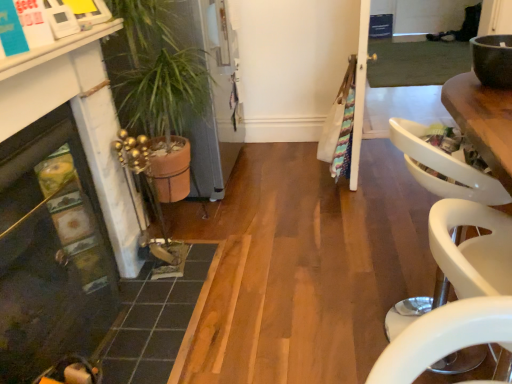
From the picture: What is the approximate width of white plastic armchair at right?

It is 38.18 centimeters.

This screenshot has height=384, width=512. What do you see at coordinates (55, 49) in the screenshot?
I see `white glossy counter top at upper left` at bounding box center [55, 49].

The width and height of the screenshot is (512, 384). What do you see at coordinates (493, 60) in the screenshot? I see `matte brown bowl at upper right` at bounding box center [493, 60].

Locate an element on the screen. Image resolution: width=512 pixels, height=384 pixels. matte brown bowl at upper right is located at coordinates (493, 60).

Locate an element on the screen. dark gray tile at lower left is located at coordinates (153, 322).

This screenshot has width=512, height=384. In order to click on white plastic armchair at right in this screenshot , I will do `click(443, 164)`.

Which is less distant, [87,311] or [65,42]?

Point [65,42]

Considering the sizes of matte black fireplace at lower left and white glossy counter top at upper left in the image, is matte black fireplace at lower left taller or shorter than white glossy counter top at upper left?

Clearly, matte black fireplace at lower left is taller compared to white glossy counter top at upper left.

Can you confirm if matte black fireplace at lower left is wider than white glossy counter top at upper left?

Incorrect, the width of matte black fireplace at lower left does not surpass that of white glossy counter top at upper left.

Could you tell me if matte black fireplace at lower left is turned towards white glossy counter top at upper left?

No, matte black fireplace at lower left is not oriented towards white glossy counter top at upper left.

Is dark gray tile at lower left in contact with matte black fireplace at lower left?

No, dark gray tile at lower left is not next to matte black fireplace at lower left.

Based on the photo, from a real-world perspective, does dark gray tile at lower left stand above matte black fireplace at lower left?

Incorrect, from a real-world perspective, dark gray tile at lower left is lower than matte black fireplace at lower left.

Which object is closer to the camera taking this photo, dark gray tile at lower left or matte black fireplace at lower left?

matte black fireplace at lower left is closer to the camera.

Does matte brown bowl at upper right come in front of white glossy counter top at upper left?

That is False.

From a real-world perspective, is matte brown bowl at upper right positioned over white glossy counter top at upper left based on gravity?

Incorrect, from a real-world perspective, matte brown bowl at upper right is lower than white glossy counter top at upper left.

Consider the image. Is matte brown bowl at upper right taller than white glossy counter top at upper left?

Correct, matte brown bowl at upper right is much taller as white glossy counter top at upper left.

Would you say matte brown bowl at upper right is a long distance from white glossy counter top at upper left?

matte brown bowl at upper right is positioned a significant distance from white glossy counter top at upper left.

Measure the distance from white plastic armchair at right to white glossy counter top at upper left.

A distance of 1.19 meters exists between white plastic armchair at right and white glossy counter top at upper left.

Is white plastic armchair at right oriented away from white glossy counter top at upper left?

white plastic armchair at right does not have its back to white glossy counter top at upper left.

Between white plastic armchair at right and white glossy counter top at upper left, which one has smaller size?

white glossy counter top at upper left.

Would you say white plastic armchair at right is inside or outside white glossy counter top at upper left?

white plastic armchair at right is outside white glossy counter top at upper left.

At what (x,y) coordinates should I click in order to perform the action: click on fireplace on the left of white glossy counter top at upper left. Please return your answer as a coordinate pair (x, y). Looking at the image, I should click on (51, 253).

Which is in front, point (20, 72) or point (25, 158)?

The point (20, 72) is closer to the camera.

Considering the relative positions of white glossy counter top at upper left and matte black fireplace at lower left in the image provided, is white glossy counter top at upper left in front of matte black fireplace at lower left?

No, white glossy counter top at upper left is behind matte black fireplace at lower left.

Considering the sizes of white glossy counter top at upper left and matte black fireplace at lower left in the image, is white glossy counter top at upper left wider or thinner than matte black fireplace at lower left?

Clearly, white glossy counter top at upper left has more width compared to matte black fireplace at lower left.

How distant is white glossy counter top at upper left from white plastic armchair at right?

A distance of 1.19 meters exists between white glossy counter top at upper left and white plastic armchair at right.

Can you tell me how much white glossy counter top at upper left and white plastic armchair at right differ in facing direction?

white glossy counter top at upper left and white plastic armchair at right are facing 0.738 degrees away from each other.

Is white glossy counter top at upper left placed right next to white plastic armchair at right?

white glossy counter top at upper left and white plastic armchair at right are not in contact.

Is white plastic armchair at right completely or partially inside white glossy counter top at upper left?

Definitely not — white plastic armchair at right is not inside white glossy counter top at upper left.

Considering the sizes of objects dark gray tile at lower left and white plastic armchair at right in the image provided, who is bigger, dark gray tile at lower left or white plastic armchair at right?

white plastic armchair at right is bigger.

This screenshot has height=384, width=512. I want to click on armchair lying above the dark gray tile at lower left (from the image's perspective), so click(443, 164).

Is dark gray tile at lower left next to white plastic armchair at right and touching it?

No, dark gray tile at lower left is not making contact with white plastic armchair at right.

In the image, is dark gray tile at lower left on the left side or the right side of white plastic armchair at right?

From the image, it's evident that dark gray tile at lower left is to the left of white plastic armchair at right.

Locate an element on the screen. fireplace on the left side of white glossy counter top at upper left is located at coordinates (51, 253).

In order to click on fireplace that appears above the dark gray tile at lower left (from a real-world perspective) in this screenshot , I will do `click(51, 253)`.

Which object lies further to the anchor point matte black fireplace at lower left, terracotta pot at left or white plastic armchair at right?

The object further to matte black fireplace at lower left is white plastic armchair at right.

When comparing their distances from matte brown bowl at upper right, does matte black fireplace at lower left or terracotta pot at left seem closer?

terracotta pot at left lies closer to matte brown bowl at upper right than the other object.

Looking at the image, which one is located closer to dark gray tile at lower left, matte brown bowl at upper right or matte black fireplace at lower left?

matte black fireplace at lower left is positioned closer to the anchor dark gray tile at lower left.

From the image, which object appears to be nearer to white glossy counter top at upper left, white plastic armchair at right or terracotta pot at left?

terracotta pot at left.

Based on their spatial positions, is terracotta pot at left or matte brown bowl at upper right further from dark gray tile at lower left?

Among the two, matte brown bowl at upper right is located further to dark gray tile at lower left.

Which object lies nearer to the anchor point matte black fireplace at lower left, dark gray tile at lower left or terracotta pot at left?

Among the two, dark gray tile at lower left is located nearer to matte black fireplace at lower left.

From the image, which object appears to be farther from matte brown bowl at upper right, white glossy counter top at upper left or dark gray tile at lower left?

dark gray tile at lower left lies further to matte brown bowl at upper right than the other object.

From the image, which object appears to be farther from dark gray tile at lower left, matte black fireplace at lower left or white plastic armchair at right?

Among the two, white plastic armchair at right is located further to dark gray tile at lower left.

Locate an element on the screen. counter top located between matte black fireplace at lower left and terracotta pot at left in the depth direction is located at coordinates (55, 49).

Image resolution: width=512 pixels, height=384 pixels. Find the location of `armchair located between dark gray tile at lower left and matte brown bowl at upper right in the left-right direction`. armchair located between dark gray tile at lower left and matte brown bowl at upper right in the left-right direction is located at coordinates (443, 164).

I want to click on bowl between white plastic armchair at right and terracotta pot at left in the front-back direction, so click(493, 60).

At what (x,y) coordinates should I click in order to perform the action: click on counter top situated between matte black fireplace at lower left and matte brown bowl at upper right from left to right. Please return your answer as a coordinate pair (x, y). The width and height of the screenshot is (512, 384). Looking at the image, I should click on (55, 49).